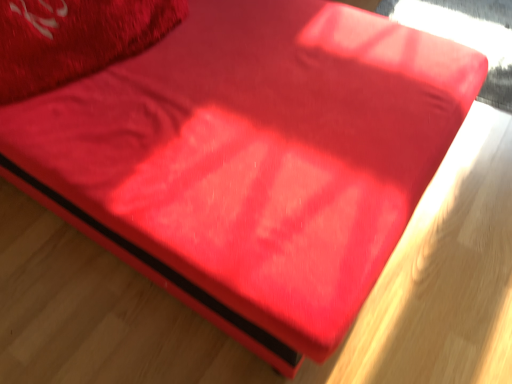
What do you see at coordinates (74, 39) in the screenshot? I see `matte red pillow at upper left` at bounding box center [74, 39].

Image resolution: width=512 pixels, height=384 pixels. I want to click on matte red pillow at upper left, so 74,39.

This screenshot has height=384, width=512. What are the coordinates of `matte red pillow at upper left` in the screenshot? It's located at (74, 39).